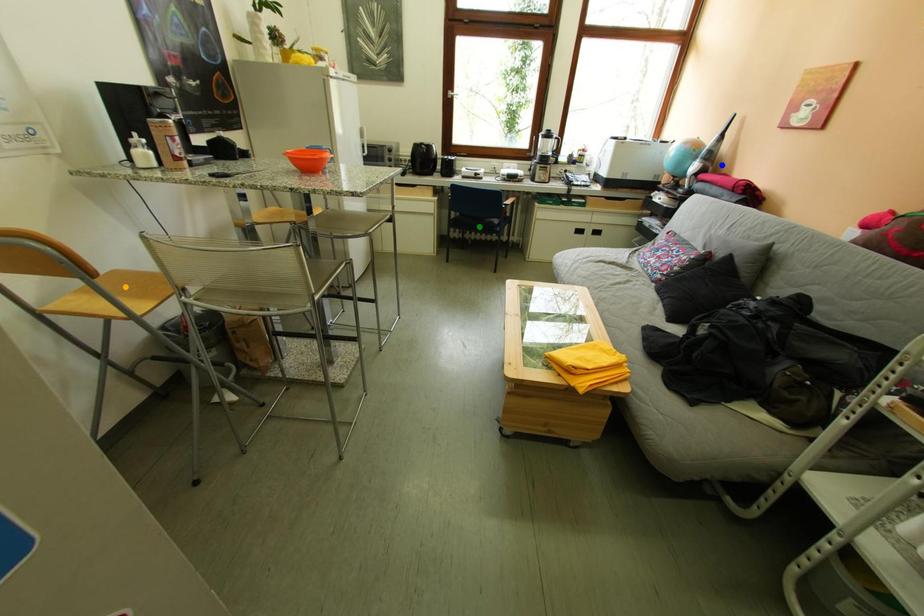
Consider the image. Order these from nearest to farthest:
A) blue point
B) orange point
C) green point

1. orange point
2. blue point
3. green point